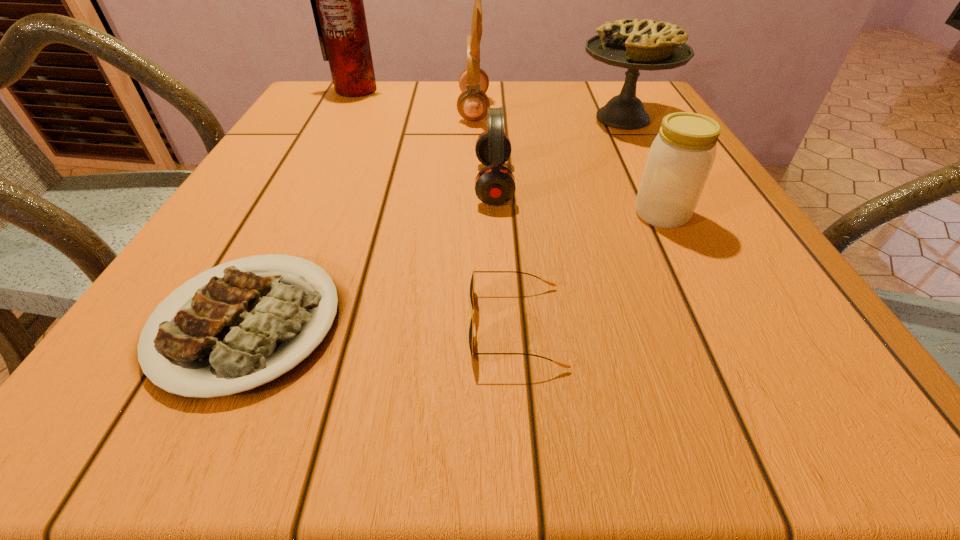
Locate an element on the screen. jar located in the right edge section of the desktop is located at coordinates (681, 156).

Locate an element on the screen. This screenshot has width=960, height=540. object that is at the far left corner is located at coordinates (337, 3).

Where is `object situated at the near left corner`? This screenshot has height=540, width=960. object situated at the near left corner is located at coordinates (244, 333).

Where is `object present at the far right corner`? The width and height of the screenshot is (960, 540). object present at the far right corner is located at coordinates (636, 44).

Where is `vacant space at the far edge of the desktop`? The height and width of the screenshot is (540, 960). vacant space at the far edge of the desktop is located at coordinates (435, 96).

You are a GUI agent. You are given a task and a screenshot of the screen. Output one action in this format:
    pyautogui.click(x=<x>, y=<y>)
    Task: Click on the free space at the near edge of the desktop
    Image resolution: width=960 pixels, height=540 pixels.
    Given the screenshot: What is the action you would take?
    pyautogui.click(x=537, y=402)

This screenshot has height=540, width=960. Find the location of `vacant space at the left edge`. vacant space at the left edge is located at coordinates (257, 214).

In the image, there is a desktop. Where is `vacant space at the right edge`? Image resolution: width=960 pixels, height=540 pixels. vacant space at the right edge is located at coordinates (731, 206).

This screenshot has width=960, height=540. In the image, there is a desktop. Find the location of `vacant space at the far left corner`. vacant space at the far left corner is located at coordinates (311, 89).

At what (x,y) coordinates should I click in order to perform the action: click on blank space at the near right corner. Please return your answer as a coordinate pair (x, y). Looking at the image, I should click on (741, 406).